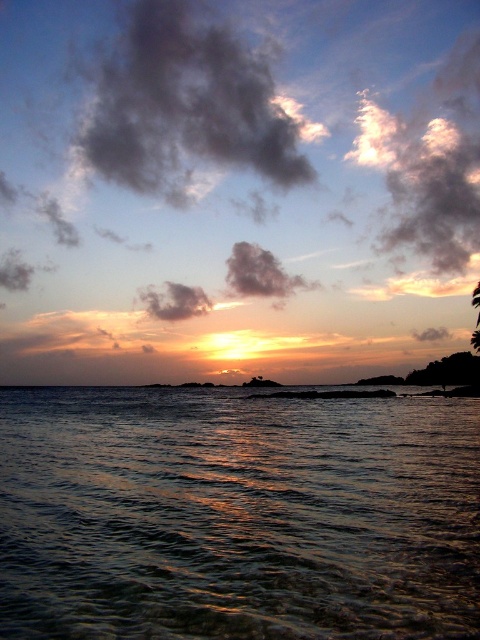
Question: Which of the following is the farthest from the observer?

Choices:
 (A) (179, 104)
 (B) (421, 589)
 (C) (411, 234)

Answer: (A)

Question: Is shiny reflective water at center below dark gray cloud at upper center?

Choices:
 (A) yes
 (B) no

Answer: (A)

Question: Is dark gray cloud at upper center to the left of fuzzy white cloud at upper right from the viewer's perspective?

Choices:
 (A) yes
 (B) no

Answer: (A)

Question: Estimate the real-world distances between objects in this image. Which object is farther from the dark gray cloud at upper center?

Choices:
 (A) shiny reflective water at center
 (B) fuzzy white cloud at upper right

Answer: (A)

Question: From the image, what is the correct spatial relationship of shiny reflective water at center in relation to dark gray cloud at upper center?

Choices:
 (A) above
 (B) below

Answer: (B)

Question: Which object appears closest to the camera in this image?

Choices:
 (A) dark gray cloud at upper center
 (B) fuzzy white cloud at upper right
 (C) shiny reflective water at center

Answer: (C)